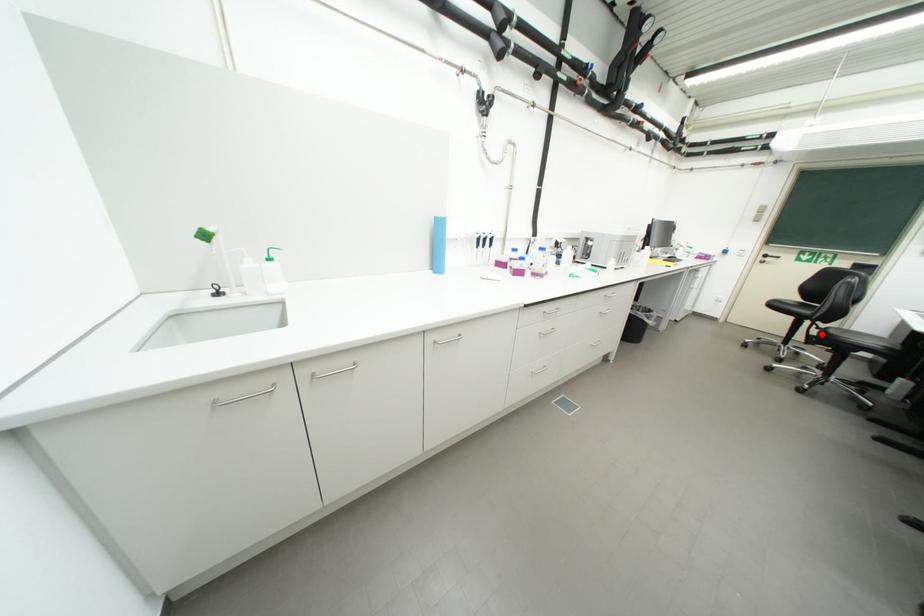
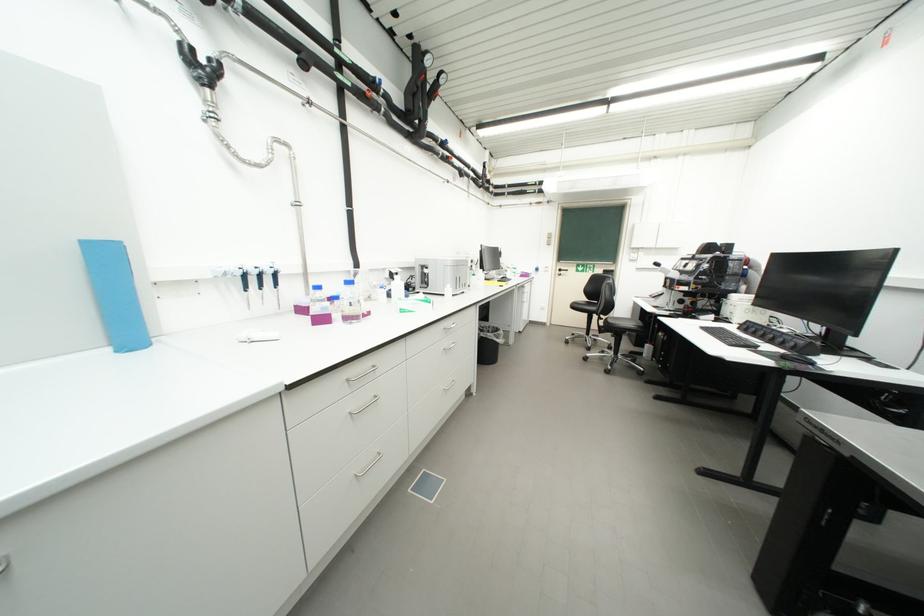
Find the pixel in the second image that matches the highlighted location in the first image.

(610, 325)